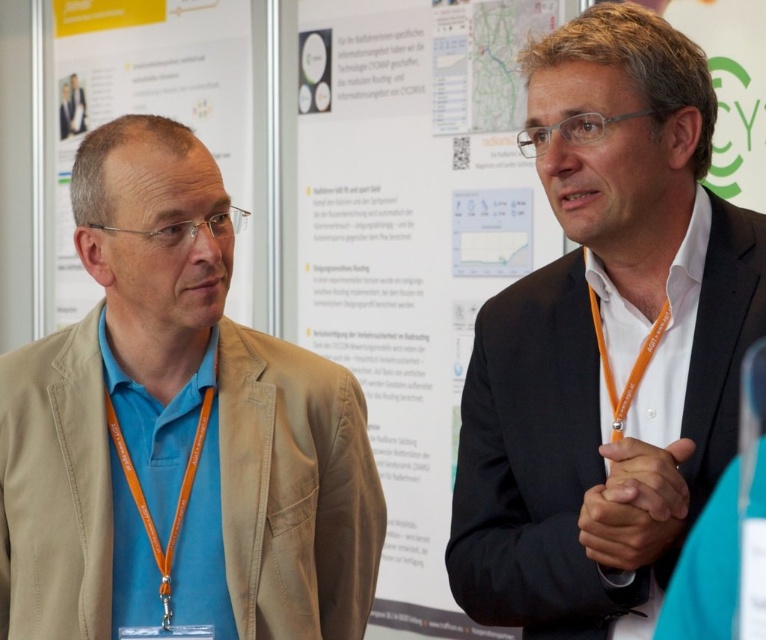
Does matte black suit at right have a greater width compared to white paper at upper left?

No, matte black suit at right is not wider than white paper at upper left.

Which of these two, matte black suit at right or white paper at upper left, stands taller?

white paper at upper left is taller.

This screenshot has height=640, width=766. What do you see at coordinates (604, 342) in the screenshot?
I see `matte black suit at right` at bounding box center [604, 342].

This screenshot has width=766, height=640. I want to click on matte black suit at right, so click(x=604, y=342).

The image size is (766, 640). What do you see at coordinates (604, 342) in the screenshot?
I see `matte black suit at right` at bounding box center [604, 342].

Can you confirm if matte black suit at right is bigger than white paper poster at center?

No.

Where is `matte black suit at right`? This screenshot has height=640, width=766. matte black suit at right is located at coordinates (604, 342).

Is matte black suit at right shorter than blue fabric shirt at left?

No.

Is matte black suit at right bigger than blue fabric shirt at left?

Actually, matte black suit at right might be smaller than blue fabric shirt at left.

Does point (463, 547) come in front of point (182, 445)?

Yes, it is in front of point (182, 445).

Locate an element on the screen. This screenshot has width=766, height=640. matte black suit at right is located at coordinates (604, 342).